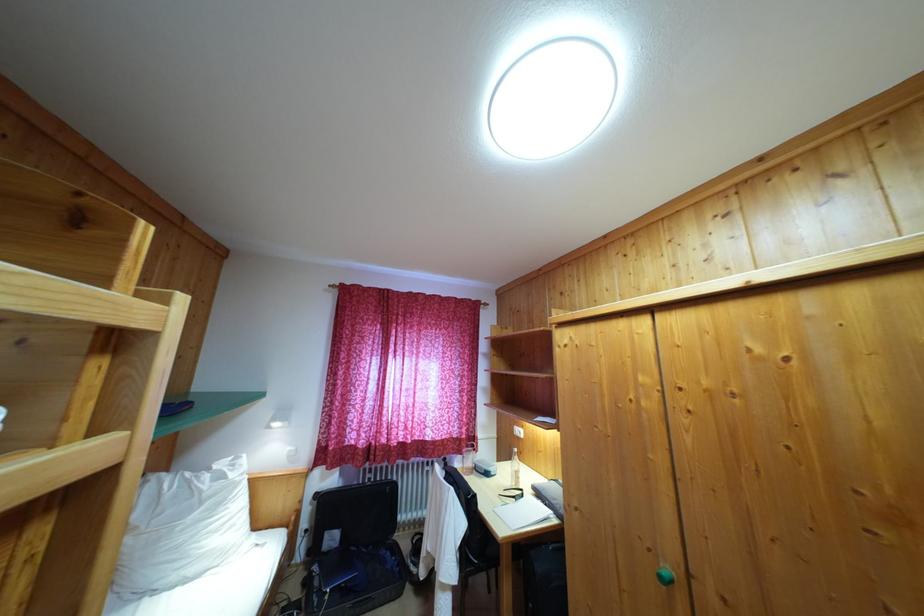
The height and width of the screenshot is (616, 924). What do you see at coordinates (517, 431) in the screenshot?
I see `a white power outlet` at bounding box center [517, 431].